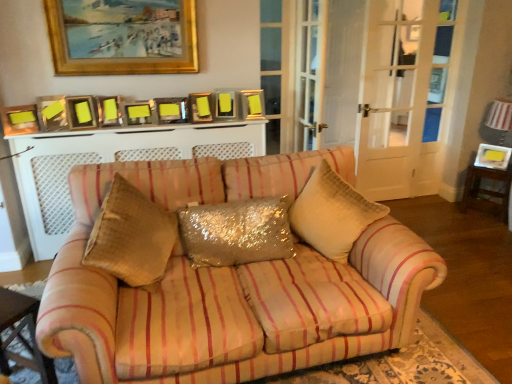
Question: Which is correct: striped fabric couch at center is inside glittery sequined pillow at center, or outside of it?

Choices:
 (A) inside
 (B) outside

Answer: (B)

Question: In the image, is striped fabric couch at center on the left side or the right side of glittery sequined pillow at center?

Choices:
 (A) left
 (B) right

Answer: (B)

Question: Estimate the real-world distances between objects in this image. Which object is farther from the white textured fireplace at center?

Choices:
 (A) matte gold picture frame at upper center, which is counted as the ninth picture frame, starting from the bottom
 (B) matte gold picture frame at left, placed as the 10th picture frame when sorted from back to front
 (C) wooden table at lower left, the 2th table when ordered from right to left
 (D) metallic silver picture frame at upper right, the eleventh picture frame in the left-to-right sequence
 (E) wooden picture frame at upper center, marked as the 5th picture frame in a bottom-to-top arrangement

Answer: (D)

Question: Considering the real-world distances, which object is farthest from the striped fabric couch at center?

Choices:
 (A) matte gold picture frame at upper center, which is counted as the ninth picture frame, starting from the bottom
 (B) metallic gold picture frame at center, marked as the fourth picture frame in a bottom-to-top arrangement
 (C) white textured fireplace at center
 (D) matte silver picture frame at upper left, the 9th picture frame in the back-to-front sequence
 (E) metallic silver picture frame at center, which appears as the eighth picture frame when ordered from the bottom

Answer: (D)